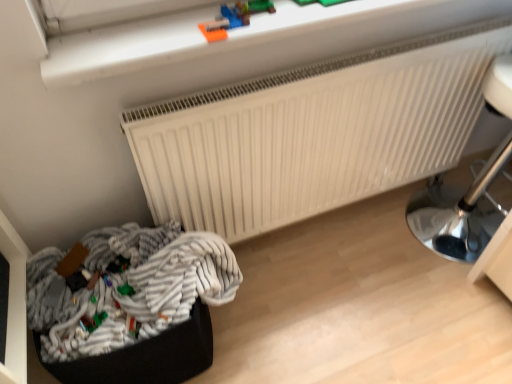
Question: Is smooth plastic toy at upper center, the first toy viewed from the right, further to camera compared to striped fabric laundry at lower left?

Choices:
 (A) no
 (B) yes

Answer: (A)

Question: Can you confirm if smooth plastic toy at upper center, which ranks as the first toy in top-to-bottom order, is shorter than striped fabric laundry at lower left?

Choices:
 (A) no
 (B) yes

Answer: (B)

Question: Does smooth plastic toy at upper center, which is the 3th toy from left to right, have a smaller size compared to striped fabric laundry at lower left?

Choices:
 (A) no
 (B) yes

Answer: (B)

Question: Considering the relative positions of smooth plastic toy at upper center, the 3th toy when ordered from bottom to top, and striped fabric laundry at lower left in the image provided, is smooth plastic toy at upper center, the 3th toy when ordered from bottom to top, to the left of striped fabric laundry at lower left from the viewer's perspective?

Choices:
 (A) yes
 (B) no

Answer: (B)

Question: From a real-world perspective, does smooth plastic toy at upper center, the 3th toy when ordered from bottom to top, sit lower than striped fabric laundry at lower left?

Choices:
 (A) yes
 (B) no

Answer: (B)

Question: Is smooth plastic toy at upper center, the 3th toy when ordered from bottom to top, not close to striped fabric laundry at lower left?

Choices:
 (A) yes
 (B) no

Answer: (B)

Question: Is white matte radiator at upper center positioned behind metallic silver lamp at right?

Choices:
 (A) no
 (B) yes

Answer: (A)

Question: From a real-world perspective, is white matte radiator at upper center physically below metallic silver lamp at right?

Choices:
 (A) yes
 (B) no

Answer: (B)

Question: Is white matte radiator at upper center oriented away from metallic silver lamp at right?

Choices:
 (A) yes
 (B) no

Answer: (B)

Question: Is the surface of white matte radiator at upper center in direct contact with metallic silver lamp at right?

Choices:
 (A) no
 (B) yes

Answer: (A)

Question: Can you confirm if white matte radiator at upper center is thinner than metallic silver lamp at right?

Choices:
 (A) yes
 (B) no

Answer: (A)

Question: Can you confirm if white matte radiator at upper center is positioned to the left of metallic silver lamp at right?

Choices:
 (A) yes
 (B) no

Answer: (A)

Question: Is striped fabric laundry at lower left thinner than smooth plastic toy at upper center, which ranks as the first toy in top-to-bottom order?

Choices:
 (A) yes
 (B) no

Answer: (B)